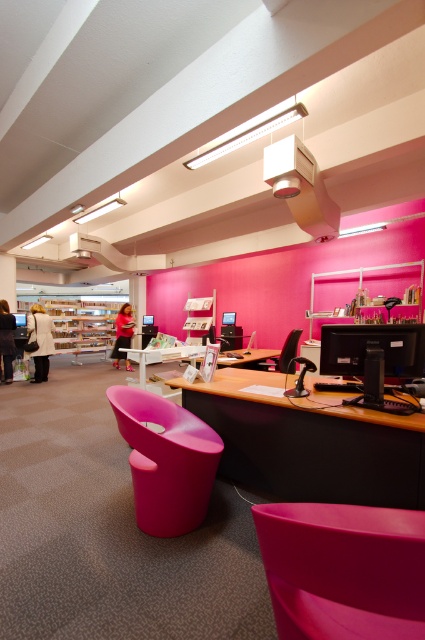
Question: Which of the following is the farthest from the observer?

Choices:
 (A) glossy plastic chair at center
 (B) white matte coat at center

Answer: (B)

Question: Can you confirm if pink plastic table at center is thinner than pink fabric person at center?

Choices:
 (A) yes
 (B) no

Answer: (B)

Question: Which point is closer to the camera?

Choices:
 (A) (380, 493)
 (B) (275, 548)
 (C) (116, 349)

Answer: (B)

Question: Among these objects, which one is farthest from the camera?

Choices:
 (A) matte black jacket at lower left
 (B) white matte coat at center

Answer: (B)

Question: Does matte plastic swivel chair at lower left come behind black glossy monitor at center?

Choices:
 (A) yes
 (B) no

Answer: (A)

Question: Does matte black jacket at lower left have a larger size compared to pink fabric person at center?

Choices:
 (A) yes
 (B) no

Answer: (B)